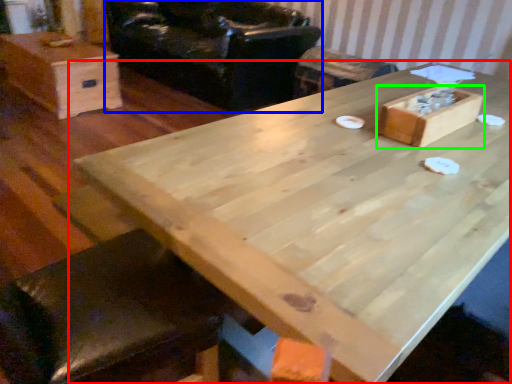
Question: Based on their relative distances, which object is nearer to table (highlighted by a red box)? Choose from armchair (highlighted by a blue box) and storage box (highlighted by a green box).

Choices:
 (A) armchair
 (B) storage box

Answer: (B)